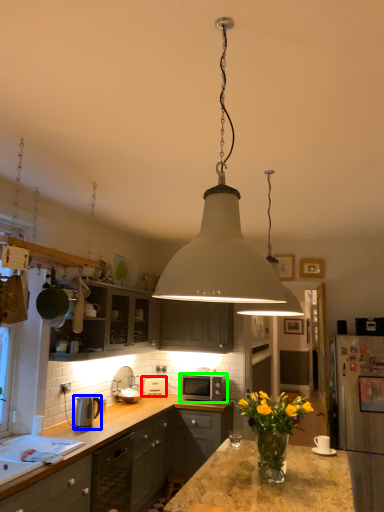
Question: Considering the real-world distances, which object is closest to appliance (highlighted by a red box)? appliance (highlighted by a blue box) or microwave oven (highlighted by a green box).

Choices:
 (A) appliance
 (B) microwave oven

Answer: (B)